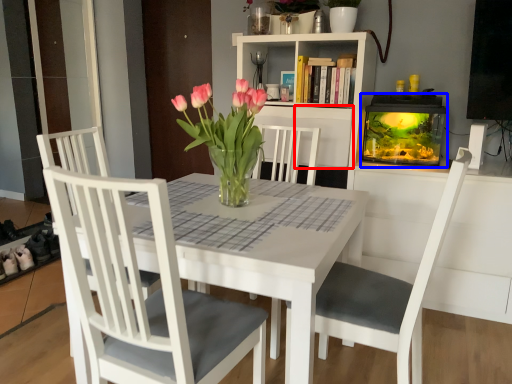
Question: Which object is closer to the camera taking this photo, shelf (highlighted by a red box) or fireplace (highlighted by a blue box)?

Choices:
 (A) shelf
 (B) fireplace

Answer: (B)